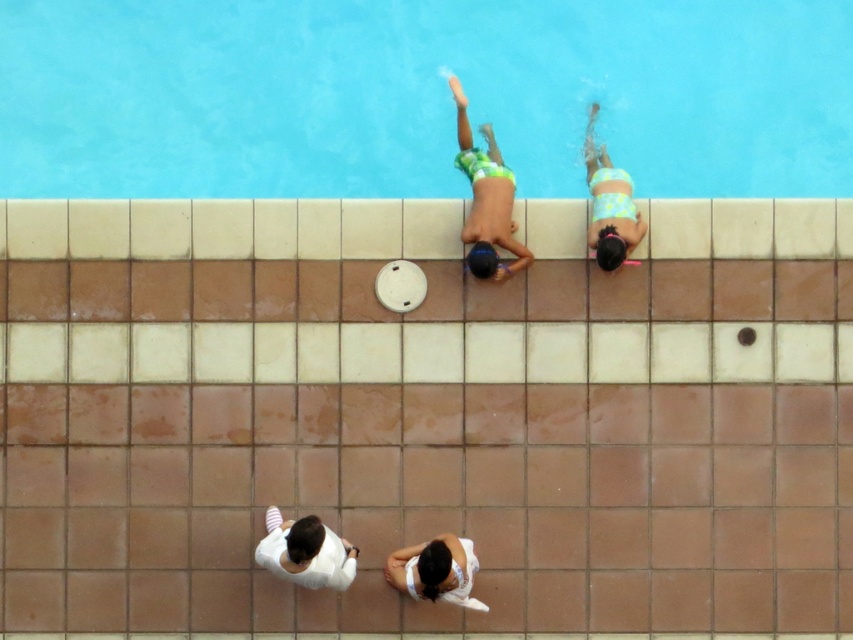
Is white cotton shirt at lower center to the left of floral swimsuit at upper right from the viewer's perspective?

Yes, white cotton shirt at lower center is to the left of floral swimsuit at upper right.

Is white cotton shirt at lower center above floral swimsuit at upper right?

No.

Describe the element at coordinates (305, 552) in the screenshot. The width and height of the screenshot is (853, 640). I see `white cotton shirt at lower center` at that location.

At what (x,y) coordinates should I click in order to perform the action: click on white cotton shirt at lower center. Please return your answer as a coordinate pair (x, y). This screenshot has height=640, width=853. Looking at the image, I should click on (305, 552).

Which is in front, point (210, 45) or point (485, 189)?

Positioned in front is point (485, 189).

Can you confirm if blue glossy water at upper center is smaller than green patterned shorts at center?

No, blue glossy water at upper center is not smaller than green patterned shorts at center.

Image resolution: width=853 pixels, height=640 pixels. What are the coordinates of `blue glossy water at upper center` in the screenshot? It's located at (421, 97).

Between green patterned shorts at center and floral swimsuit at upper right, which one appears on the right side from the viewer's perspective?

floral swimsuit at upper right is more to the right.

Consider the image. Does green patterned shorts at center appear on the left side of floral swimsuit at upper right?

Yes, green patterned shorts at center is to the left of floral swimsuit at upper right.

Measure the distance between green patterned shorts at center and camera.

green patterned shorts at center is 10.52 meters away from camera.

I want to click on green patterned shorts at center, so click(x=486, y=198).